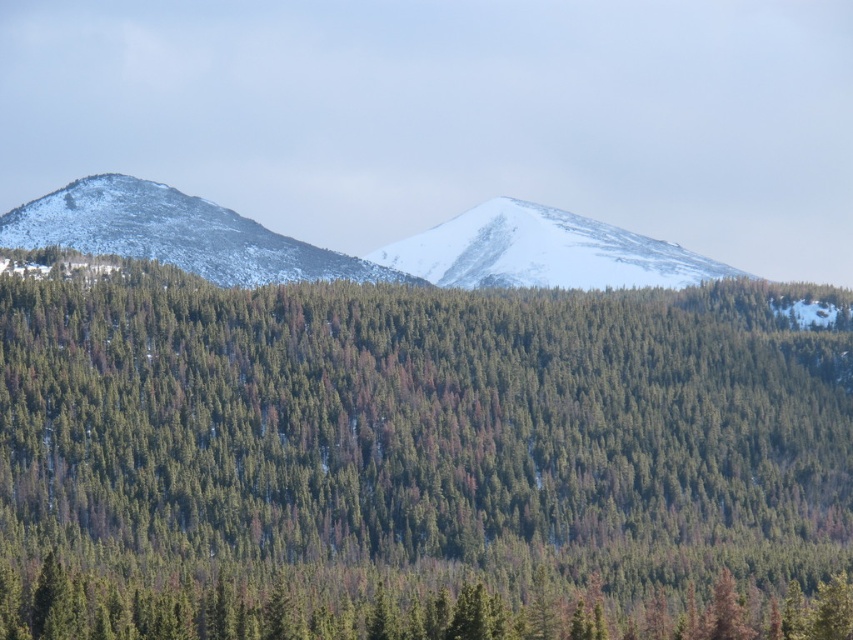
Question: Is snowy white mountain at left smaller than white snow-covered mountain at center?

Choices:
 (A) no
 (B) yes

Answer: (B)

Question: Observing the image, what is the correct spatial positioning of snowy white mountain at left in reference to white snow-covered mountain at center?

Choices:
 (A) above
 (B) below

Answer: (B)

Question: Considering the real-world distances, which object is closest to the snowy white mountain at left?

Choices:
 (A) white snow-covered mountain at center
 (B) green matte tree at center

Answer: (A)

Question: Which point is closer to the camera taking this photo?

Choices:
 (A) (631, 292)
 (B) (611, 257)

Answer: (A)

Question: In this image, where is snowy white mountain at left located relative to white snow-covered mountain at center?

Choices:
 (A) below
 (B) above

Answer: (A)

Question: Estimate the real-world distances between objects in this image. Which object is farther from the white snow-covered mountain at center?

Choices:
 (A) snowy white mountain at left
 (B) green matte tree at center

Answer: (B)